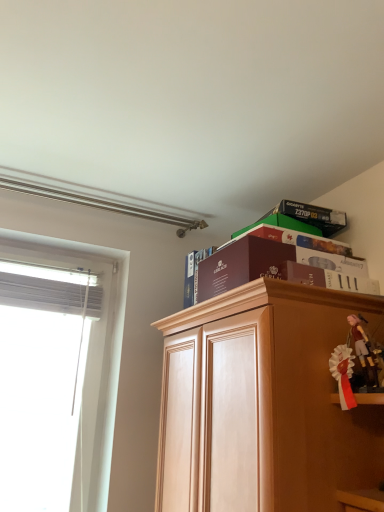
Question: Considering the relative sizes of white satin ribbon at right, the 2th toy from the right, and matte black box at upper right in the image provided, is white satin ribbon at right, the 2th toy from the right, taller than matte black box at upper right?

Choices:
 (A) yes
 (B) no

Answer: (B)

Question: Is white satin ribbon at right, the 2th toy from the right, far from matte black box at upper right?

Choices:
 (A) no
 (B) yes

Answer: (A)

Question: From a real-world perspective, is white satin ribbon at right, marked as the 1th toy in a left-to-right arrangement, located beneath matte black box at upper right?

Choices:
 (A) yes
 (B) no

Answer: (A)

Question: Does white satin ribbon at right, marked as the 1th toy in a left-to-right arrangement, have a lesser width compared to matte black box at upper right?

Choices:
 (A) yes
 (B) no

Answer: (A)

Question: Is white satin ribbon at right, marked as the 1th toy in a left-to-right arrangement, closer to the viewer compared to matte black box at upper right?

Choices:
 (A) no
 (B) yes

Answer: (B)

Question: From the image's perspective, is maroon paper at upper center, the second paperback book from the front, located above or below maroon cardboard box at upper center, positioned as the 1th paperback book in front-to-back order?

Choices:
 (A) above
 (B) below

Answer: (B)

Question: Choose the correct answer: Is maroon paper at upper center, the first paperback book from the back, inside maroon cardboard box at upper center, the 2th paperback book positioned from the back, or outside it?

Choices:
 (A) inside
 (B) outside

Answer: (B)

Question: Is point (193, 293) closer or farther from the camera than point (201, 300)?

Choices:
 (A) farther
 (B) closer

Answer: (A)

Question: Is maroon paper at upper center, the first paperback book from the back, in front of or behind maroon cardboard box at upper center, positioned as the 1th paperback book in front-to-back order, in the image?

Choices:
 (A) front
 (B) behind

Answer: (B)

Question: From the image's perspective, is matte black box at upper right above or below maroon paper at upper center, the first paperback book from the back?

Choices:
 (A) below
 (B) above

Answer: (B)

Question: In terms of width, does matte black box at upper right look wider or thinner when compared to maroon paper at upper center, the second paperback book from the front?

Choices:
 (A) wide
 (B) thin

Answer: (A)

Question: From a real-world perspective, is matte black box at upper right above or below maroon paper at upper center, the first paperback book from the back?

Choices:
 (A) above
 (B) below

Answer: (A)

Question: From their relative heights in the image, would you say matte black box at upper right is taller or shorter than maroon paper at upper center, the second paperback book from the front?

Choices:
 (A) short
 (B) tall

Answer: (B)

Question: Considering the positions of matte black box at upper right and pink fabric doll at upper right, which is counted as the 2th toy, starting from the left, in the image, is matte black box at upper right wider or thinner than pink fabric doll at upper right, which is counted as the 2th toy, starting from the left,?

Choices:
 (A) wide
 (B) thin

Answer: (A)

Question: From a real-world perspective, is matte black box at upper right above or below pink fabric doll at upper right, which is counted as the 2th toy, starting from the left?

Choices:
 (A) above
 (B) below

Answer: (A)